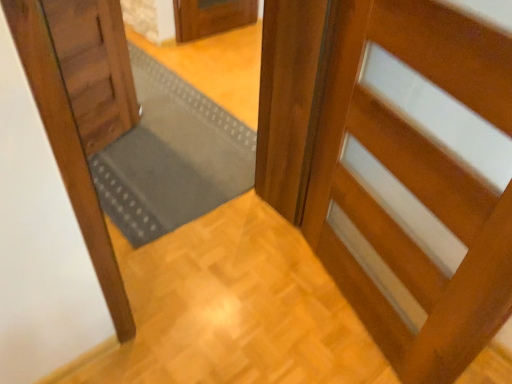
In order to click on empty space that is ontop of gray rubber doormat at center (from a real-world perspective) in this screenshot , I will do `click(170, 135)`.